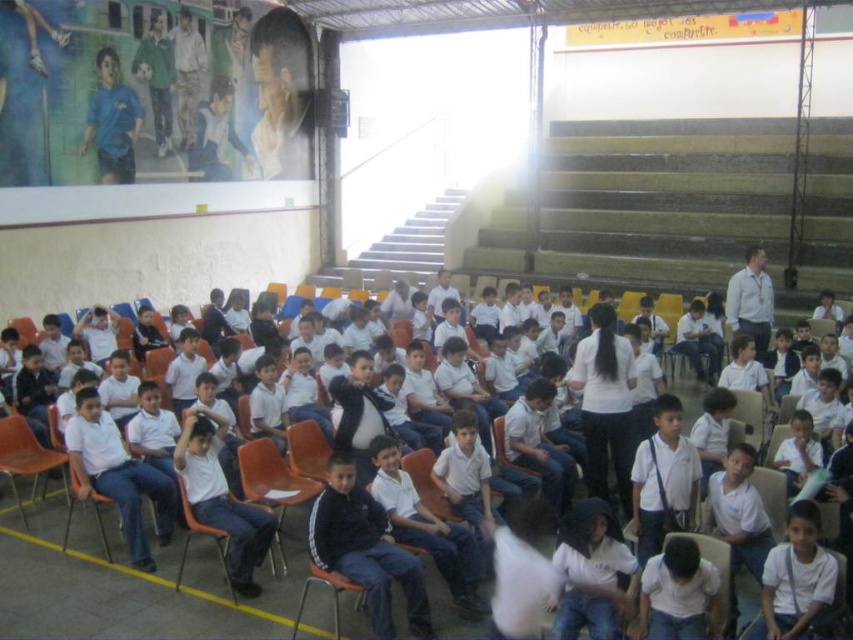
Question: Estimate the real-world distances between objects in this image. Which object is farther from the white matte shirt at center?

Choices:
 (A) matte blue shirt at upper left
 (B) white cotton shirt at center

Answer: (A)

Question: Estimate the real-world distances between objects in this image. Which object is farther from the white cotton shirt at center?

Choices:
 (A) matte blue shirt at upper left
 (B) white matte shirt at lower right
 (C) white matte shirt at center
 (D) white matte shirt at lower center

Answer: (A)

Question: Can you confirm if white cotton shirt at center is positioned below white matte shirt at lower center?

Choices:
 (A) yes
 (B) no

Answer: (A)

Question: Which point is closer to the camera?

Choices:
 (A) white matte shirt at lower center
 (B) white cotton shirt at center
 (C) matte blue shirt at upper left
 (D) white matte shirt at center

Answer: (A)

Question: Is white cotton shirt at center bigger than white matte shirt at lower right?

Choices:
 (A) yes
 (B) no

Answer: (A)

Question: Is white cotton shirt at center to the left of white matte shirt at lower right from the viewer's perspective?

Choices:
 (A) no
 (B) yes

Answer: (B)